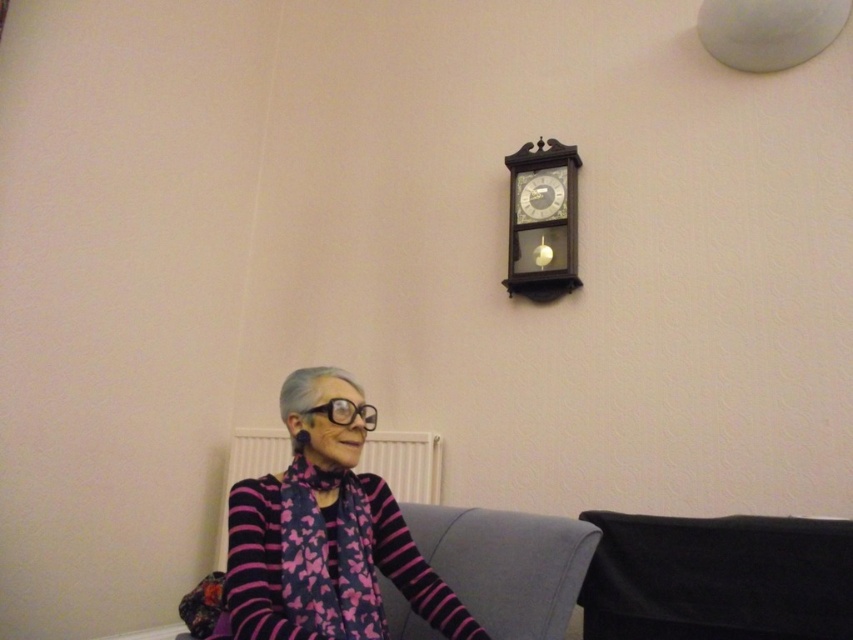
From the picture: Can you confirm if black fabric at lower right is shorter than wooden clock at upper center?

Yes, black fabric at lower right is shorter than wooden clock at upper center.

Between black fabric at lower right and wooden clock at upper center, which one has less height?

Standing shorter between the two is black fabric at lower right.

Where is `black fabric at lower right`? Image resolution: width=853 pixels, height=640 pixels. black fabric at lower right is located at coordinates (717, 579).

Find the location of a particular element. black fabric at lower right is located at coordinates 717,579.

Is fabric couch at lower center to the left of white plastic radiator at lower center from the viewer's perspective?

Incorrect, fabric couch at lower center is not on the left side of white plastic radiator at lower center.

Is fabric couch at lower center smaller than white plastic radiator at lower center?

Actually, fabric couch at lower center might be larger than white plastic radiator at lower center.

Which is behind, point (412, 624) or point (401, 451)?

The point (401, 451) is more distant.

Identify the location of fabric couch at lower center. (506, 564).

Measure the distance between black fabric at lower right and fabric couch at lower center.

black fabric at lower right and fabric couch at lower center are 13.11 inches apart from each other.

Between point (717, 609) and point (560, 529), which one is positioned in front?

Positioned in front is point (560, 529).

Locate an element on the screen. black fabric at lower right is located at coordinates (717, 579).

I want to click on black fabric at lower right, so click(717, 579).